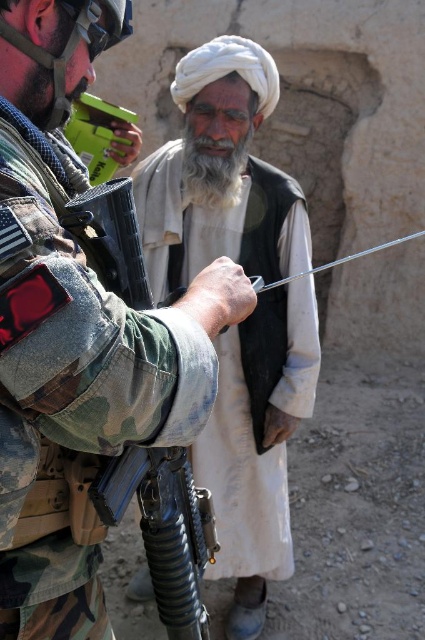
Is camouflage fabric uniform at left behind white soft beard at center?

No.

Between camouflage fabric uniform at left and white soft beard at center, which one is positioned lower?

camouflage fabric uniform at left is below.

At what (x,y) coordinates should I click in order to perform the action: click on camouflage fabric uniform at left. Please return your answer as a coordinate pair (x, y). The height and width of the screenshot is (640, 425). Looking at the image, I should click on (78, 321).

This screenshot has width=425, height=640. I want to click on camouflage fabric uniform at left, so click(x=78, y=321).

Does point (27, 216) come closer to viewer compared to point (226, 192)?

Yes, it is.

In the scene shown: Is camouflage fabric uniform at left below white cotton turban at upper center?

No.

You are a GUI agent. You are given a task and a screenshot of the screen. Output one action in this format:
    pyautogui.click(x=<x>, y=<y>)
    Task: Click on the camouflage fabric uniform at left
    The width and height of the screenshot is (425, 640).
    Given the screenshot: What is the action you would take?
    click(78, 321)

Identify the location of camouflage fabric uniform at left. This screenshot has width=425, height=640. (78, 321).

Between white cotton turban at upper center and white soft beard at center, which one is positioned lower?

white cotton turban at upper center

Is white cotton turban at upper center smaller than white soft beard at center?

No.

Does point (201, 480) lie in front of point (184, 154)?

No, it is behind (184, 154).

The image size is (425, 640). In order to click on white cotton turban at upper center in this screenshot , I will do `click(220, 176)`.